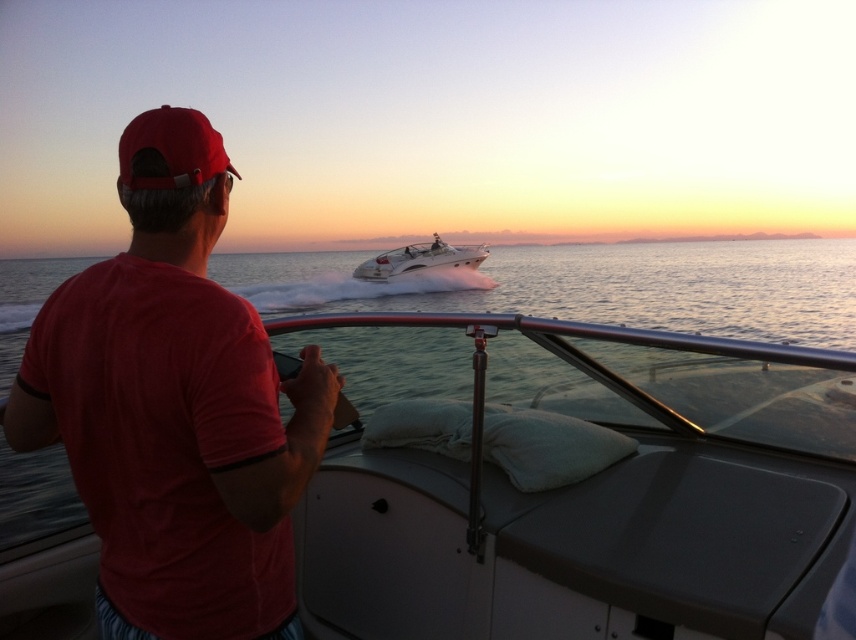
Is matte red baseball cap at upper left bigger than white glossy speedboat at center?

No.

Based on the photo, can you confirm if matte red baseball cap at upper left is wider than white glossy speedboat at center?

Incorrect, matte red baseball cap at upper left's width does not surpass white glossy speedboat at center's.

This screenshot has width=856, height=640. I want to click on matte red baseball cap at upper left, so click(171, 148).

Locate an element on the screen. The width and height of the screenshot is (856, 640). matte red baseball cap at upper left is located at coordinates (171, 148).

Which is above, matte red t-shirt at left or clear water at center?

clear water at center is higher up.

You are a GUI agent. You are given a task and a screenshot of the screen. Output one action in this format:
    pyautogui.click(x=<x>, y=<y>)
    Task: Click on the matte red t-shirt at left
    The width and height of the screenshot is (856, 640).
    Given the screenshot: What is the action you would take?
    pyautogui.click(x=174, y=406)

Is point (135, 410) less distant than point (835, 257)?

Yes, point (135, 410) is in front of point (835, 257).

Where is `matte red t-shirt at left`? matte red t-shirt at left is located at coordinates (174, 406).

Between clear water at center and white glossy speedboat at center, which one appears on the right side from the viewer's perspective?

white glossy speedboat at center is more to the right.

Is clear water at center to the right of white glossy speedboat at center from the viewer's perspective?

In fact, clear water at center is to the left of white glossy speedboat at center.

Between point (405, 304) and point (408, 246), which one is positioned in front?

Point (405, 304) is more forward.

Locate an element on the screen. clear water at center is located at coordinates (593, 285).